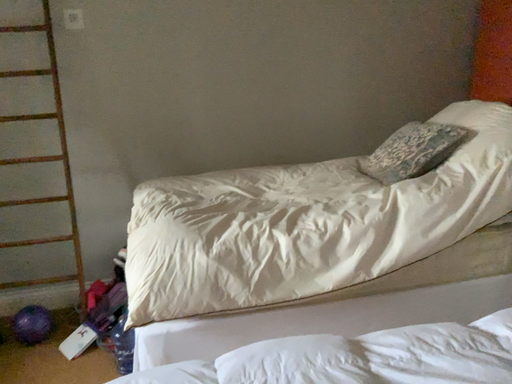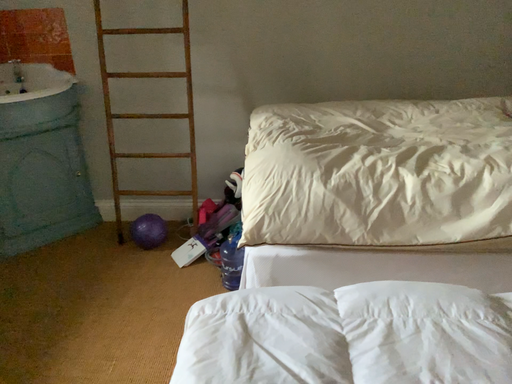
Question: Which way did the camera rotate in the video?

Choices:
 (A) rotated downward
 (B) rotated upward

Answer: (A)